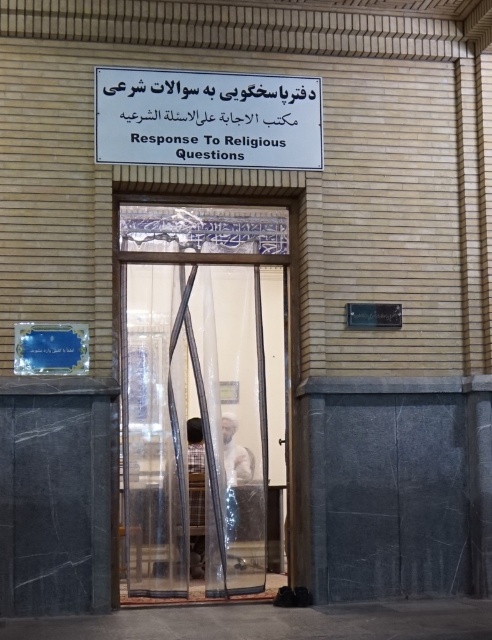
From the picture: Can you confirm if transparent mesh door at center is positioned below white cotton shirt at center?

No, transparent mesh door at center is not below white cotton shirt at center.

From the picture: Is transparent mesh door at center closer to the viewer compared to white cotton shirt at center?

Yes, transparent mesh door at center is closer to the viewer.

Is point (125, 374) in front of point (227, 476)?

Yes, point (125, 374) is in front of point (227, 476).

Image resolution: width=492 pixels, height=640 pixels. What are the coordinates of `transparent mesh door at center` in the screenshot? It's located at (202, 394).

Can you confirm if white paper sign at center is smaller than white cotton shirt at center?

Actually, white paper sign at center might be larger than white cotton shirt at center.

Describe the element at coordinates (208, 118) in the screenshot. I see `white paper sign at center` at that location.

Which is behind, point (160, 96) or point (241, 518)?

Positioned behind is point (241, 518).

You are a GUI agent. You are given a task and a screenshot of the screen. Output one action in this format:
    pyautogui.click(x=<x>, y=<y>)
    Task: Click on the white paper sign at center
    This screenshot has height=640, width=492.
    Given the screenshot: What is the action you would take?
    pyautogui.click(x=208, y=118)

Which is more to the right, white cotton shirt at center or light brown wooden chair at center?

Positioned to the right is white cotton shirt at center.

Is white cotton shirt at center above light brown wooden chair at center?

Indeed, white cotton shirt at center is positioned over light brown wooden chair at center.

Who is more forward, (237, 480) or (201, 460)?

Point (237, 480) is in front.

This screenshot has width=492, height=640. I want to click on white cotton shirt at center, so click(x=236, y=477).